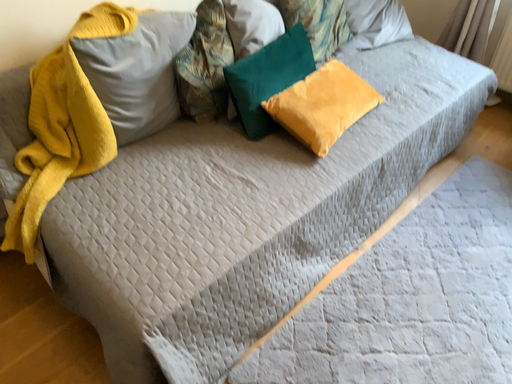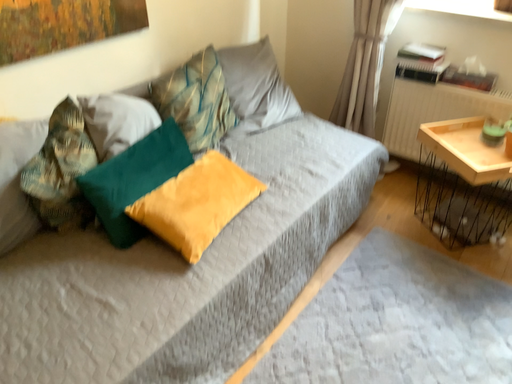
Question: How did the camera likely rotate when shooting the video?

Choices:
 (A) rotated upward
 (B) rotated downward

Answer: (A)